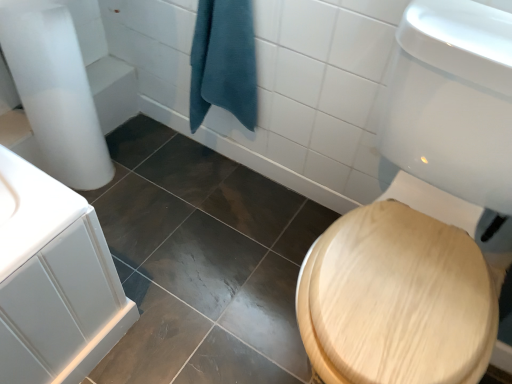
Describe the element at coordinates (398, 299) in the screenshot. I see `wooden at right` at that location.

Measure the distance between point [483,241] and camera.

Point [483,241] and camera are 1.11 meters apart from each other.

Image resolution: width=512 pixels, height=384 pixels. Find the location of `wooden at right`. wooden at right is located at coordinates (398, 299).

What do you see at coordinates (223, 62) in the screenshot?
I see `teal cotton towel at center` at bounding box center [223, 62].

What is the approximate height of teal cotton towel at center?

teal cotton towel at center is 49.01 centimeters tall.

At what (x,y) coordinates should I click in order to perform the action: click on teal cotton towel at center. Please return your answer as a coordinate pair (x, y). Looking at the image, I should click on (223, 62).

Image resolution: width=512 pixels, height=384 pixels. In order to click on wooden at right in this screenshot , I will do `click(398, 299)`.

Considering the relative positions of wooden at right and teal cotton towel at center in the image provided, is wooden at right to the left or to the right of teal cotton towel at center?

From the image, it's evident that wooden at right is to the right of teal cotton towel at center.

Between wooden at right and teal cotton towel at center, which one is positioned in front?

wooden at right is more forward.

Is point (400, 205) farther from camera compared to point (254, 89)?

No.

From the image's perspective, relative to teal cotton towel at center, is wooden at right above or below?

wooden at right is situated lower than teal cotton towel at center in the image.

From a real-world perspective, is wooden at right above or below teal cotton towel at center?

From a real-world perspective, wooden at right is physically below teal cotton towel at center.

Considering the sizes of objects wooden at right and teal cotton towel at center in the image provided, who is thinner, wooden at right or teal cotton towel at center?

teal cotton towel at center is thinner.

Between wooden at right and teal cotton towel at center, which one has less height?

Standing shorter between the two is teal cotton towel at center.

Does wooden at right have a smaller size compared to teal cotton towel at center?

No.

Based on the photo, choose the correct answer: Is wooden at right inside teal cotton towel at center or outside it?

wooden at right is outside teal cotton towel at center.

Is there a large distance between wooden at right and teal cotton towel at center?

wooden at right is actually quite close to teal cotton towel at center.

Does wooden at right turn towards teal cotton towel at center?

No.

How many degrees apart are the facing directions of wooden at right and teal cotton towel at center?

The angular difference between wooden at right and teal cotton towel at center is 0.000653 degrees.

Locate an element on the screen. bath towel above the wooden at right (from the image's perspective) is located at coordinates (223, 62).

Between teal cotton towel at center and wooden at right, which one appears on the left side from the viewer's perspective?

teal cotton towel at center is more to the left.

Looking at this image, is the depth of teal cotton towel at center less than that of wooden at right?

That is False.

Does point (191, 77) lie behind point (384, 152)?

Yes.

From the image's perspective, is teal cotton towel at center above or below wooden at right?

teal cotton towel at center is above wooden at right.

From a real-world perspective, which is physically below, teal cotton towel at center or wooden at right?

wooden at right, from a real-world perspective.

Can you confirm if teal cotton towel at center is wider than wooden at right?

Incorrect, the width of teal cotton towel at center does not surpass that of wooden at right.

Between teal cotton towel at center and wooden at right, which one has less height?

Standing shorter between the two is teal cotton towel at center.

Between teal cotton towel at center and wooden at right, which one has smaller size?

teal cotton towel at center.

Is teal cotton towel at center outside of wooden at right?

teal cotton towel at center is positioned outside wooden at right.

Consider the image. Are teal cotton towel at center and wooden at right far apart?

teal cotton towel at center is actually quite close to wooden at right.

Is teal cotton towel at center oriented away from wooden at right?

That's not correct — teal cotton towel at center is not looking away from wooden at right.

What's the angular difference between teal cotton towel at center and wooden at right's facing directions?

0.000653 degrees separate the facing orientations of teal cotton towel at center and wooden at right.

Identify the location of bath towel behind the wooden at right. (223, 62).

You are a GUI agent. You are given a task and a screenshot of the screen. Output one action in this format:
    pyautogui.click(x=<x>, y=<y>)
    Task: Click on the bath towel behind the wooden at right
    The image size is (512, 384).
    Given the screenshot: What is the action you would take?
    pyautogui.click(x=223, y=62)

I want to click on toilet bowl located on the right of teal cotton towel at center, so click(398, 299).